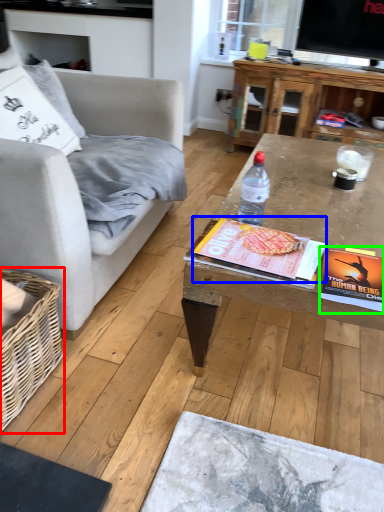
Question: Which object is positioned farthest from basket (highlighted by a red box)? Select from magazine (highlighted by a blue box) and paperback book (highlighted by a green box).

Choices:
 (A) magazine
 (B) paperback book

Answer: (B)